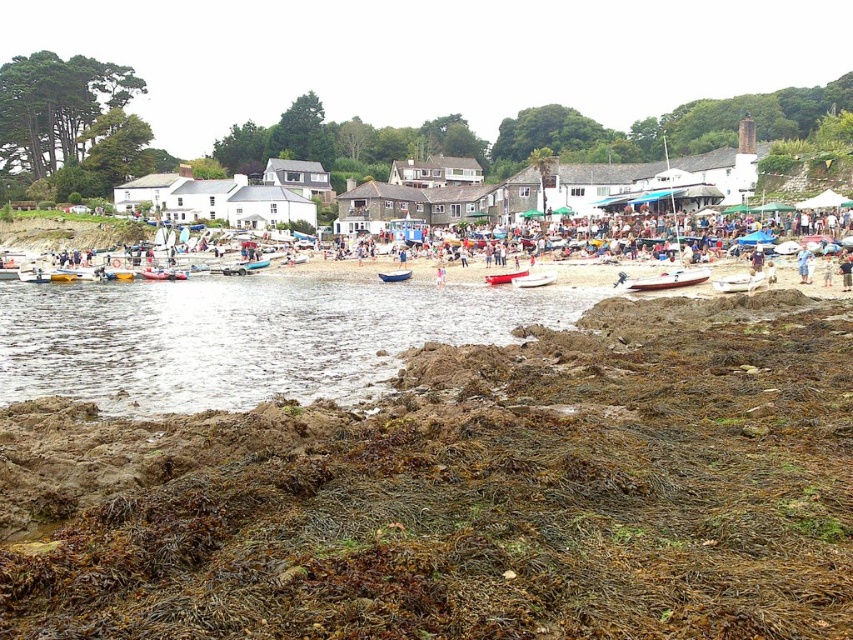
Question: Estimate the real-world distances between objects in this image. Which object is closer to the brown/muddy soil at lower left?

Choices:
 (A) white plastic boat at lower left
 (B) white matte boat at center
 (C) white glossy boat at center

Answer: (B)

Question: Is white plastic boat at center bigger than white plastic boat at lower left?

Choices:
 (A) no
 (B) yes

Answer: (A)

Question: Considering the relative positions of clear water at lower left and red plastic boat at center in the image provided, where is clear water at lower left located with respect to red plastic boat at center?

Choices:
 (A) left
 (B) right

Answer: (A)

Question: Is white plastic boat at center bigger than red plastic boat at center?

Choices:
 (A) no
 (B) yes

Answer: (A)

Question: Which point is closer to the camera?

Choices:
 (A) blue matte boat at center
 (B) white matte boat at center
 (C) white plastic boat at center

Answer: (B)

Question: Which of the following is the closest to the observer?

Choices:
 (A) red plastic boat at center
 (B) white glossy boat at center

Answer: (B)